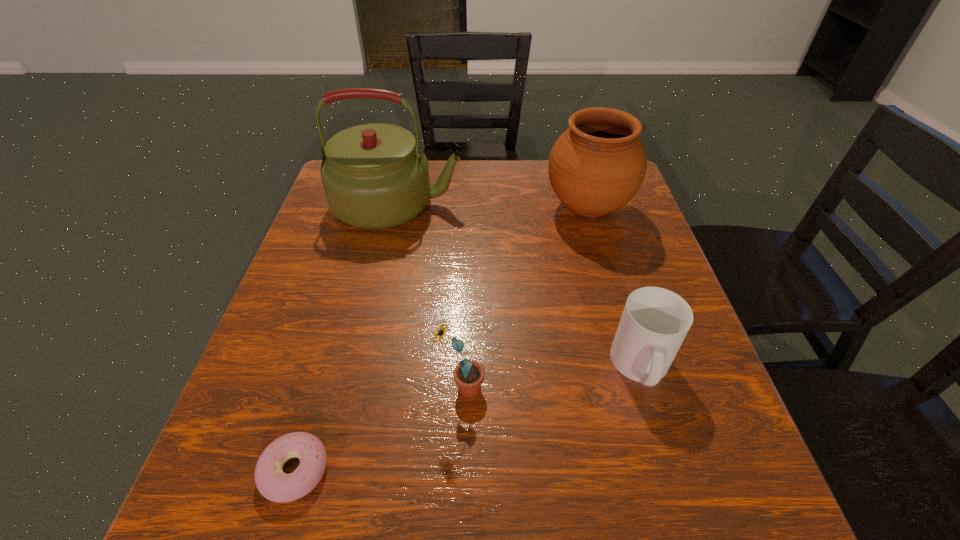
Find the location of a particular element. The height and width of the screenshot is (540, 960). object that is at the far right corner is located at coordinates (598, 164).

Where is `free space at the far edge of the desktop`? The width and height of the screenshot is (960, 540). free space at the far edge of the desktop is located at coordinates (492, 177).

Where is `vacant space at the left edge of the desktop`? vacant space at the left edge of the desktop is located at coordinates (346, 281).

Image resolution: width=960 pixels, height=540 pixels. I want to click on vacant space at the right edge of the desktop, so click(x=694, y=365).

Locate an element on the screen. The image size is (960, 540). vacant space at the near left corner is located at coordinates (254, 494).

I want to click on vacant area that lies between the tallest object and the pottery, so click(x=492, y=206).

At what (x,y) coordinates should I click in order to perform the action: click on free space between the mug and the tallest object. Please return your answer as a coordinate pair (x, y). This screenshot has width=960, height=540. Looking at the image, I should click on (519, 285).

The height and width of the screenshot is (540, 960). In order to click on empty location between the mug and the shortest object in this screenshot , I will do `click(468, 418)`.

Where is `vacant space that is in between the doughnut and the fourth tallest object`? The width and height of the screenshot is (960, 540). vacant space that is in between the doughnut and the fourth tallest object is located at coordinates (468, 418).

This screenshot has height=540, width=960. What are the coordinates of `empty location between the third tallest object and the mug` in the screenshot? It's located at (551, 377).